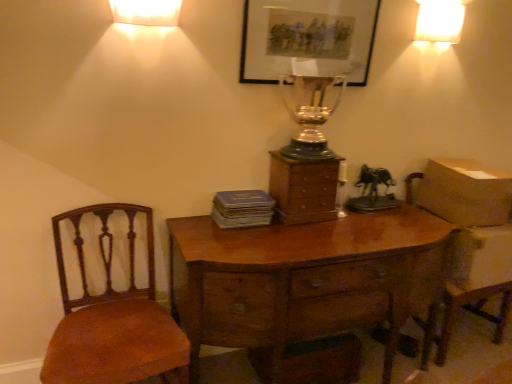
Question: From the image's perspective, is white glossy lampshade at upper right, arranged as the 1th lamp when viewed from the right, located above or below white frosted glass lampshade at upper center, the first lamp viewed from the left?

Choices:
 (A) above
 (B) below

Answer: (A)

Question: Considering the positions of point pyautogui.click(x=449, y=36) and point pyautogui.click(x=121, y=21), is point pyautogui.click(x=449, y=36) closer or farther from the camera than point pyautogui.click(x=121, y=21)?

Choices:
 (A) closer
 (B) farther

Answer: (B)

Question: Based on their relative distances, which object is farther from the brown fabric chair at left?

Choices:
 (A) matte gray book at center
 (B) matte black picture frame at upper center
 (C) wooden chest of drawers at center
 (D) white frosted glass lampshade at upper center, positioned as the 1th lamp in bottom-to-top order
 (E) white glossy lampshade at upper right, arranged as the 2th lamp when viewed from the front

Answer: (E)

Question: Which of these objects is positioned closest to the brown fabric chair at left?

Choices:
 (A) silver/glass trophy at center
 (B) white glossy lampshade at upper right, arranged as the 2th lamp when viewed from the front
 (C) wooden desk at center
 (D) matte black picture frame at upper center
 (E) wooden armchair at right

Answer: (C)